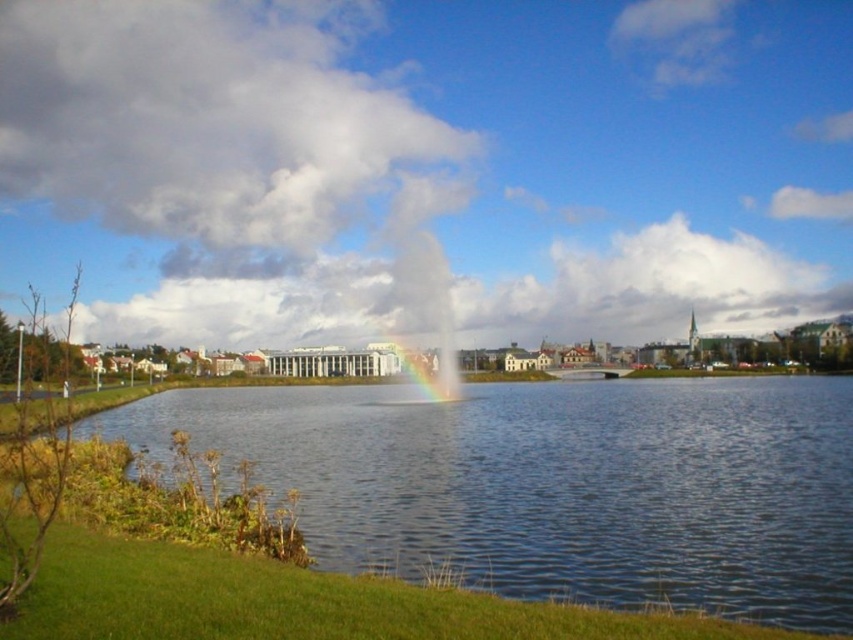
Question: Which point appears farthest from the camera in this image?

Choices:
 (A) (462, 438)
 (B) (370, 108)

Answer: (B)

Question: Is clear water at center closer to the viewer compared to cloudy sky at upper center?

Choices:
 (A) no
 (B) yes

Answer: (B)

Question: Is clear water at center wider than cloudy sky at upper center?

Choices:
 (A) no
 (B) yes

Answer: (A)

Question: Which point appears closest to the camera in this image?

Choices:
 (A) (161, 164)
 (B) (698, 404)

Answer: (B)

Question: Is clear water at center smaller than cloudy sky at upper center?

Choices:
 (A) no
 (B) yes

Answer: (B)

Question: Which point is closer to the camera?

Choices:
 (A) clear water at center
 (B) cloudy sky at upper center

Answer: (A)